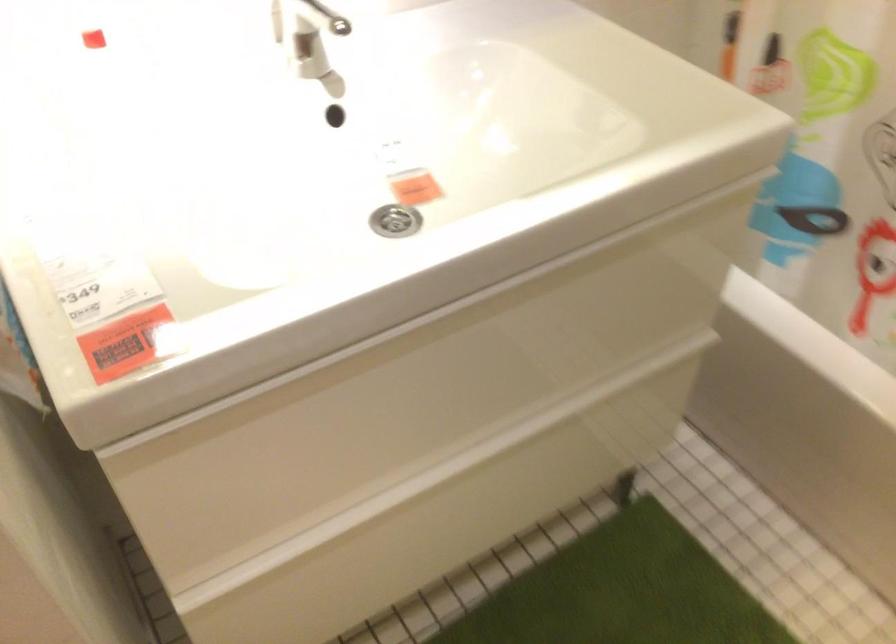
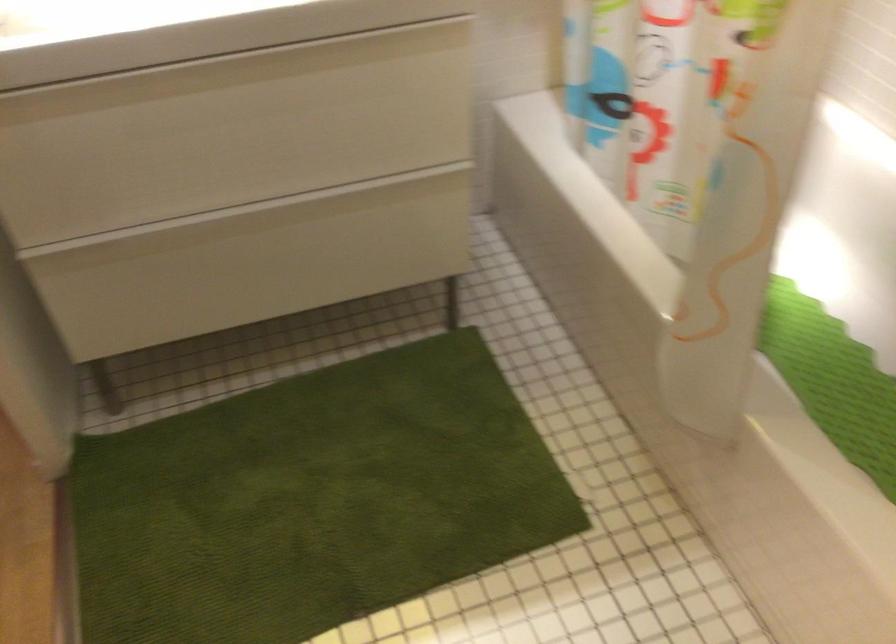
Question: The first image is from the beginning of the video and the second image is from the end. How did the camera likely rotate when shooting the video?

Choices:
 (A) Left
 (B) Right
 (C) Up
 (D) Down

Answer: (A)